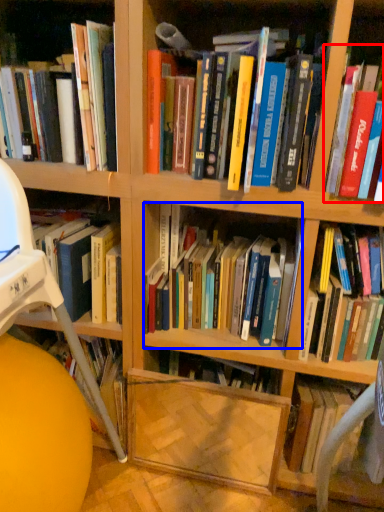
Question: Among these objects, which one is nearest to the camera, book (highlighted by a red box) or book (highlighted by a blue box)?

Choices:
 (A) book
 (B) book

Answer: (A)